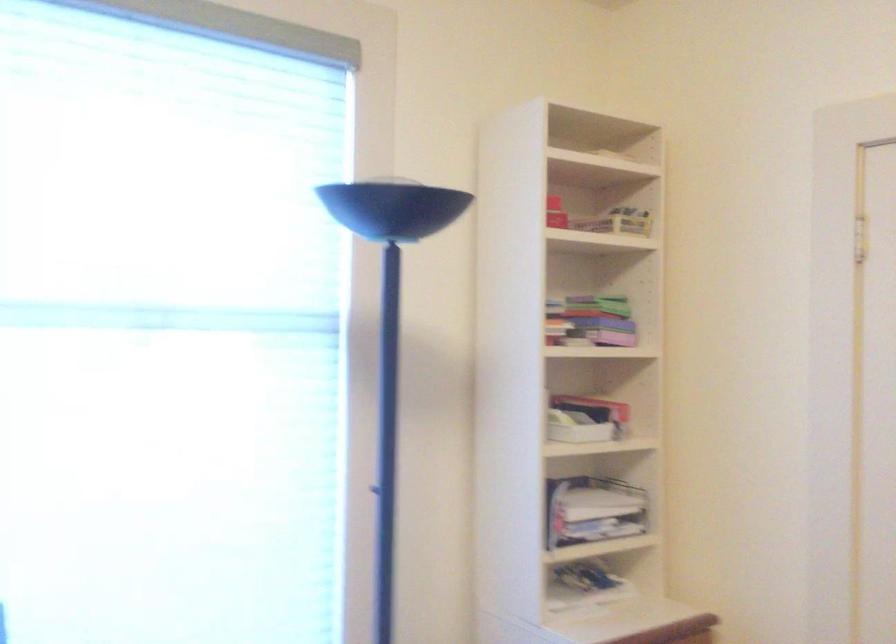
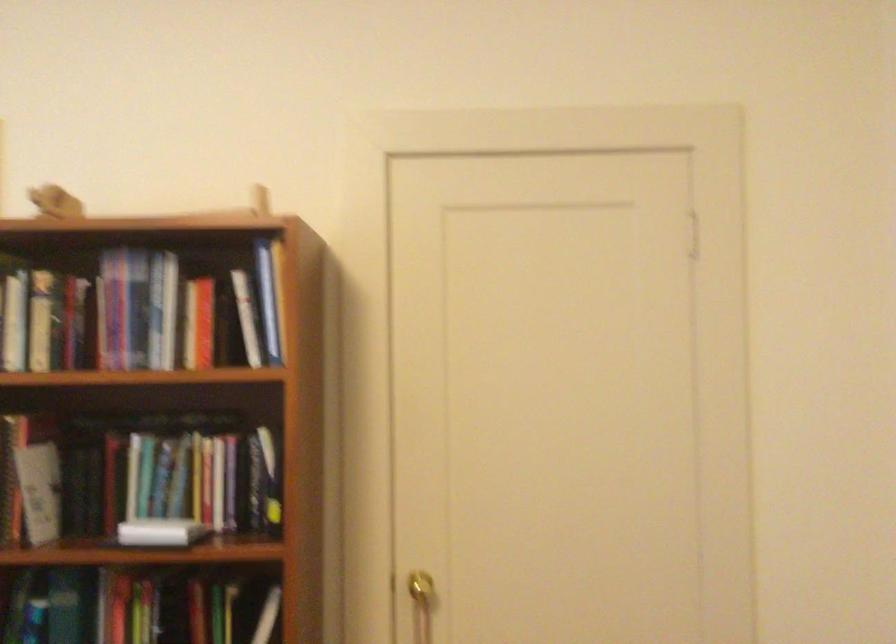
Question: The first image is from the beginning of the video and the second image is from the end. How did the camera likely rotate when shooting the video?

Choices:
 (A) Left
 (B) Right
 (C) Up
 (D) Down

Answer: (B)